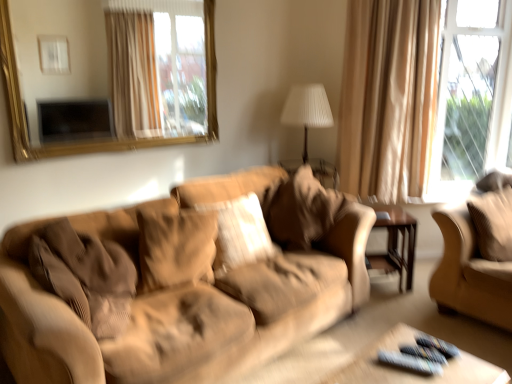
Question: Relative to white pleated fabric at center, is brown wood side table at center right in front or behind?

Choices:
 (A) behind
 (B) front

Answer: (B)

Question: Considering the positions of point (384, 226) and point (320, 114), is point (384, 226) closer or farther from the camera than point (320, 114)?

Choices:
 (A) farther
 (B) closer

Answer: (B)

Question: Which object is positioned closest to the suede-like beige couch at right?

Choices:
 (A) beige fabric curtain at upper right
 (B) clear glass window at upper right
 (C) suede-like beige pillow at center, acting as the third pillow starting from the left
 (D) corduroy pillow at right, the 4th pillow viewed from the left
 (E) brown wood side table at center right

Answer: (D)

Question: Estimate the real-world distances between objects in this image. Which object is closer to the corduroy pillow at right, arranged as the first pillow when viewed from the right?

Choices:
 (A) white pleated fabric at center
 (B) suede-like beige pillow at center, which appears as the 4th pillow when viewed from the right
 (C) suede-like beige couch at right
 (D) beige fabric curtain at upper right
 (E) wooden remote control tray at lower right

Answer: (C)